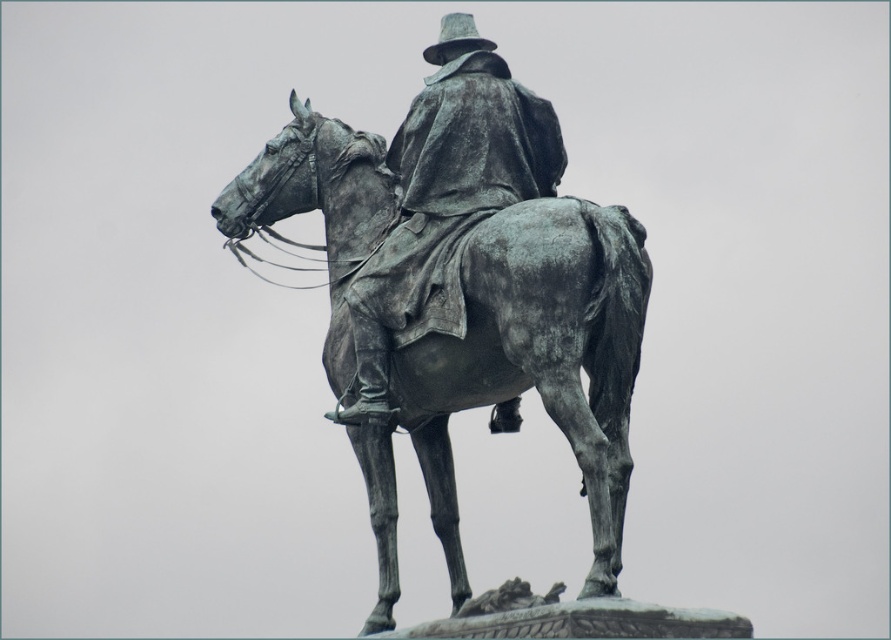
In the scene shown: You are an art conservator examining the bronze statue horse at center and the bronze statue at center. Which part of the statue is taller?

The bronze statue horse at center is much taller than the bronze statue at center.

You are standing in front of a bronze statue of a man on a horse. The statue is located at the center of the image. If you were to draw a straight line from your current position to the bronze statue horse at center, at what coordinate point would this line intersect the statue?

The line would intersect the bronze statue horse at center at the coordinate point specified in the description, which is at point (538, 356).

You are an art conservator assessing the space requirements for moving the bronze statue horse at center and the bronze statue at center. Which of the two requires more width for transportation?

The bronze statue horse at center requires more width for transportation since its width surpasses that of the bronze statue at center.